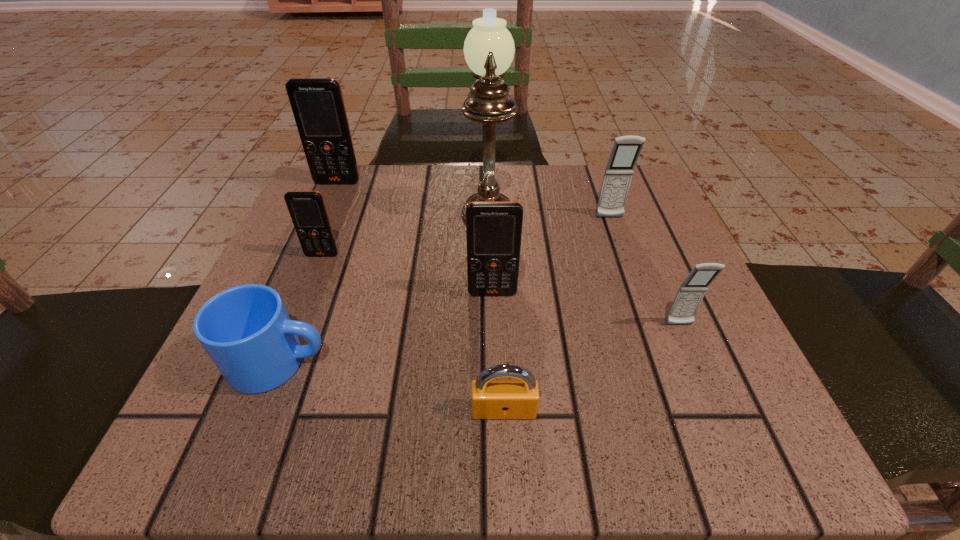
At what (x,y) coordinates should I click in order to perform the action: click on oil lamp. Please return your answer as a coordinate pair (x, y). Image resolution: width=960 pixels, height=540 pixels. Looking at the image, I should click on (489, 48).

Locate an element on the screen. the farthest cellular telephone is located at coordinates (317, 104).

Image resolution: width=960 pixels, height=540 pixels. I want to click on the second tallest object, so click(317, 104).

Locate an element on the screen. The width and height of the screenshot is (960, 540). the fourth nearest cellular telephone is located at coordinates (626, 149).

You are a GUI agent. You are given a task and a screenshot of the screen. Output one action in this format:
    pyautogui.click(x=<x>, y=<y>)
    Task: Click on the bigger gray cellular telephone
    The image size is (960, 540).
    Given the screenshot: What is the action you would take?
    pyautogui.click(x=626, y=149)

At what (x,y) coordinates should I click in order to perform the action: click on the second nearest cellular telephone. Please return your answer as a coordinate pair (x, y). Looking at the image, I should click on (493, 228).

The width and height of the screenshot is (960, 540). Find the location of `the nearest orange cellular telephone`. the nearest orange cellular telephone is located at coordinates (493, 228).

You are a GUI agent. You are given a task and a screenshot of the screen. Output one action in this format:
    pyautogui.click(x=<x>, y=<y>)
    Task: Click on the fourth farthest object
    This screenshot has height=540, width=960.
    Given the screenshot: What is the action you would take?
    pyautogui.click(x=307, y=209)

Locate an element on the screen. The width and height of the screenshot is (960, 540). the second farthest orange cellular telephone is located at coordinates (307, 209).

Identify the location of the rightmost object. (690, 294).